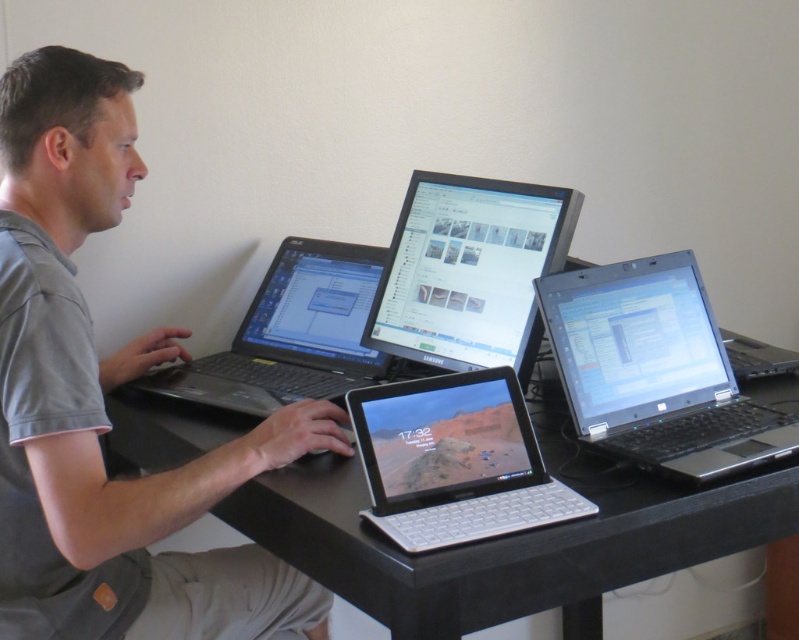
You are a photographer standing in the room and want to take a picture of the gray fabric shirt at left and the black plastic table at center. Which object will appear larger in your photo?

The gray fabric shirt at left will appear larger in the photo because it is closer to the viewer than the black plastic table at center.

You are standing in the room and see the gray fabric shirt at left. Where is it located in the image?

The gray fabric shirt at left is located at point (102,403).

You are a delivery person who needs to place a small package on the desk. The package must be placed exactly at the coordinates of the black plastic laptop at right. Where should you place the package on the desk?

The package should be placed at the coordinates of the black plastic laptop at right, which is at point (654,369).